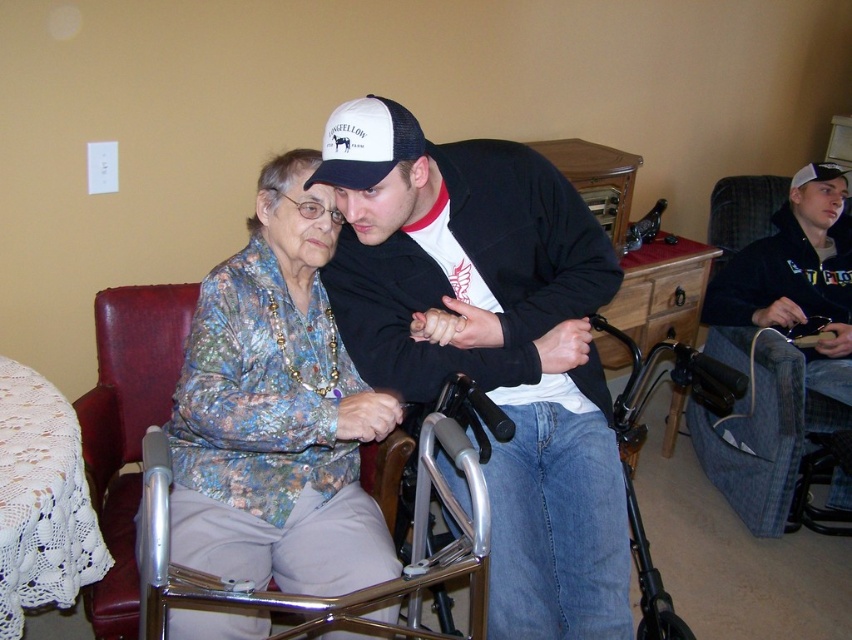
Question: Which point appears farthest from the camera in this image?

Choices:
 (A) (613, 408)
 (B) (363, 186)

Answer: (A)

Question: Which object is farther from the camera taking this photo?

Choices:
 (A) black hoodie at right
 (B) matte black jacket at center
 (C) silver metallic walker at center
 (D) white mesh baseball cap at upper center

Answer: (A)

Question: Which object appears farthest from the camera in this image?

Choices:
 (A) black hoodie at right
 (B) silver metallic walker at center
 (C) white mesh baseball cap at upper center

Answer: (A)

Question: Is black hoodie at right below white mesh baseball cap at upper center?

Choices:
 (A) no
 (B) yes

Answer: (B)

Question: Does matte black jacket at center have a lesser width compared to silver metallic walker at center?

Choices:
 (A) no
 (B) yes

Answer: (A)

Question: Is floral fabric blouse at center in front of silver metallic walker at center?

Choices:
 (A) yes
 (B) no

Answer: (A)